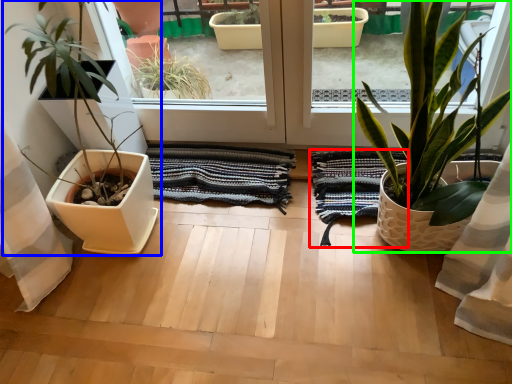
Question: Based on their relative distances, which object is farther from bath towel (highlighted by a red box)? Choose from houseplant (highlighted by a blue box) and houseplant (highlighted by a green box).

Choices:
 (A) houseplant
 (B) houseplant

Answer: (A)